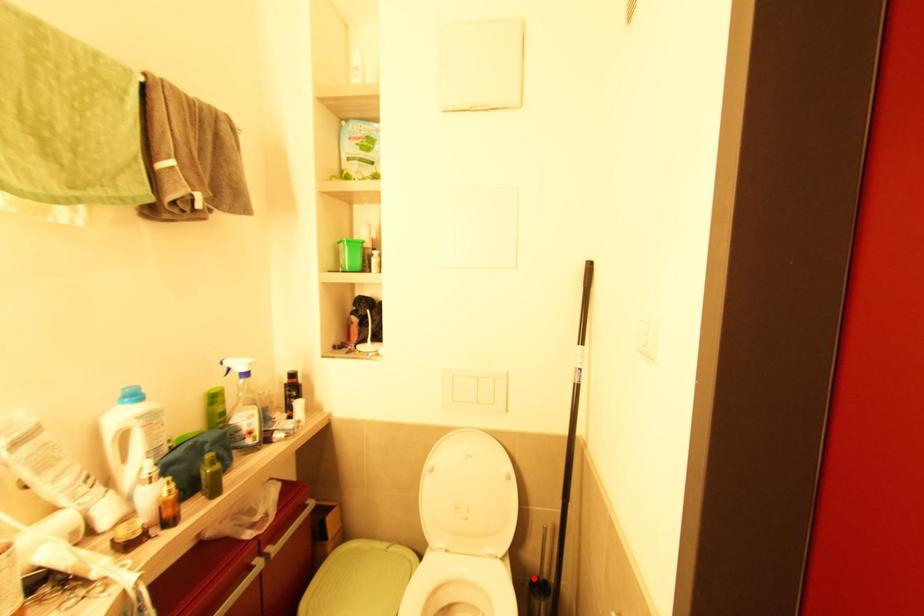
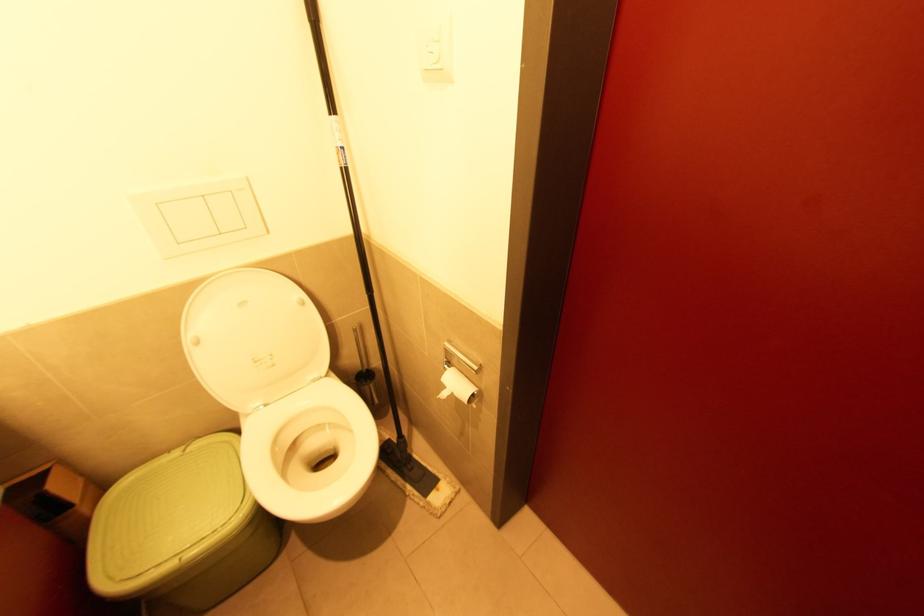
Question: I am providing you with two images of the same scene from different viewpoints. In image1, a red point is highlighted. Considering the same 3D point in image2, which of the following is correct?

Choices:
 (A) It is closer
 (B) It is farther

Answer: (B)